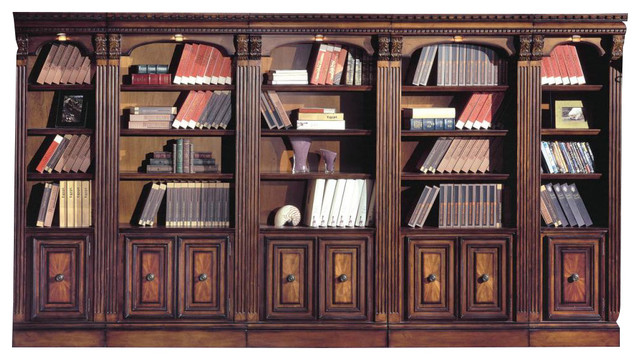
Locate an element on the screen. Image resolution: width=640 pixels, height=360 pixels. first shelf is located at coordinates (47, 229), (164, 232), (289, 234), (454, 223), (585, 232).